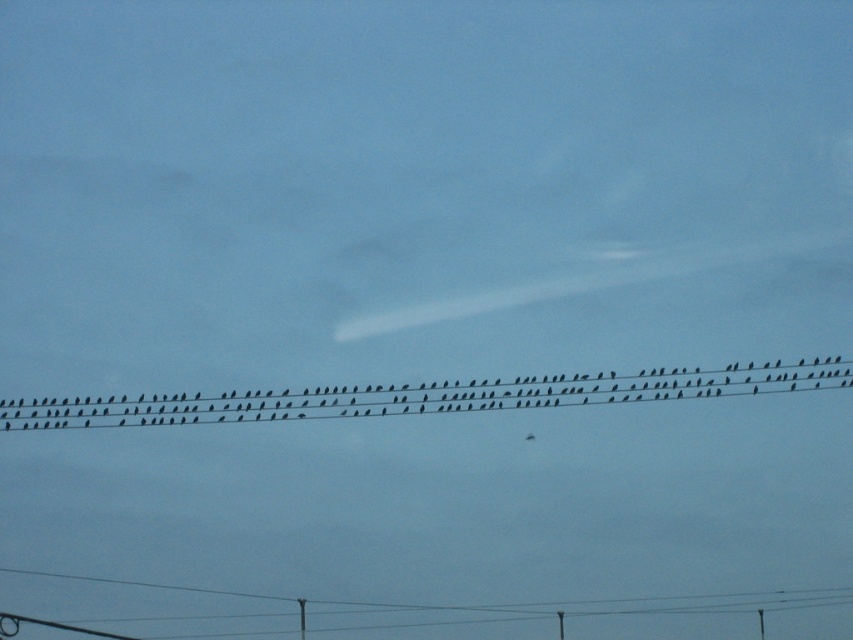
Who is taller, black matte birds at center or smooth gray telegraph pole at lower right?

With more height is black matte birds at center.

Is point (111, 396) less distant than point (763, 621)?

No, it is behind (763, 621).

This screenshot has width=853, height=640. I want to click on black matte birds at center, so click(422, 396).